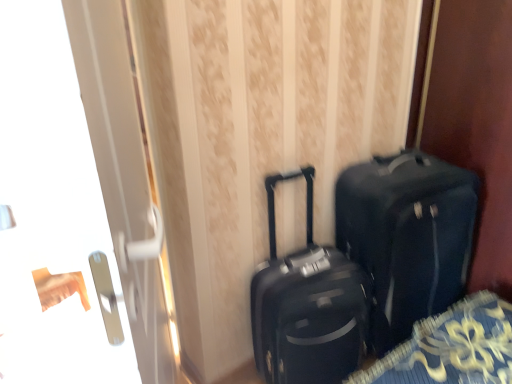
Question: Does matte black suitcase at center appear on the right side of transparent glass door at left?

Choices:
 (A) no
 (B) yes

Answer: (B)

Question: Is matte black suitcase at center looking in the opposite direction of transparent glass door at left?

Choices:
 (A) yes
 (B) no

Answer: (B)

Question: Can you confirm if matte black suitcase at center is taller than transparent glass door at left?

Choices:
 (A) yes
 (B) no

Answer: (B)

Question: Can we say matte black suitcase at center lies outside transparent glass door at left?

Choices:
 (A) yes
 (B) no

Answer: (A)

Question: Is matte black suitcase at center next to transparent glass door at left and touching it?

Choices:
 (A) no
 (B) yes

Answer: (A)

Question: Would you say matte black suitcase at center is to the left or to the right of matte black suitcase at center in the picture?

Choices:
 (A) left
 (B) right

Answer: (B)

Question: In terms of height, does matte black suitcase at center look taller or shorter compared to matte black suitcase at center?

Choices:
 (A) short
 (B) tall

Answer: (B)

Question: From a real-world perspective, is matte black suitcase at center positioned above or below matte black suitcase at center?

Choices:
 (A) above
 (B) below

Answer: (B)

Question: From the image's perspective, relative to matte black suitcase at center, is matte black suitcase at center above or below?

Choices:
 (A) below
 (B) above

Answer: (B)

Question: Would you say matte black suitcase at center is to the left or to the right of transparent glass door at left in the picture?

Choices:
 (A) left
 (B) right

Answer: (B)

Question: Is point (377, 177) closer or farther from the camera than point (92, 326)?

Choices:
 (A) farther
 (B) closer

Answer: (B)

Question: Is matte black suitcase at center bigger or smaller than transparent glass door at left?

Choices:
 (A) small
 (B) big

Answer: (A)

Question: Is matte black suitcase at center wider or thinner than transparent glass door at left?

Choices:
 (A) wide
 (B) thin

Answer: (A)

Question: Looking at their shapes, would you say matte black suitcase at center is wider or thinner than matte black suitcase at center?

Choices:
 (A) wide
 (B) thin

Answer: (B)

Question: Considering the positions of point (267, 281) and point (372, 210), is point (267, 281) closer or farther from the camera than point (372, 210)?

Choices:
 (A) closer
 (B) farther

Answer: (A)